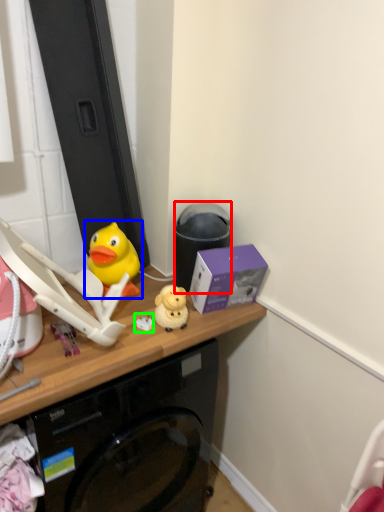
Question: Estimate the real-world distances between objects in this image. Which object is closer to trash bin/can (highlighted by a red box), toy (highlighted by a blue box) or toy (highlighted by a green box)?

Choices:
 (A) toy
 (B) toy

Answer: (A)